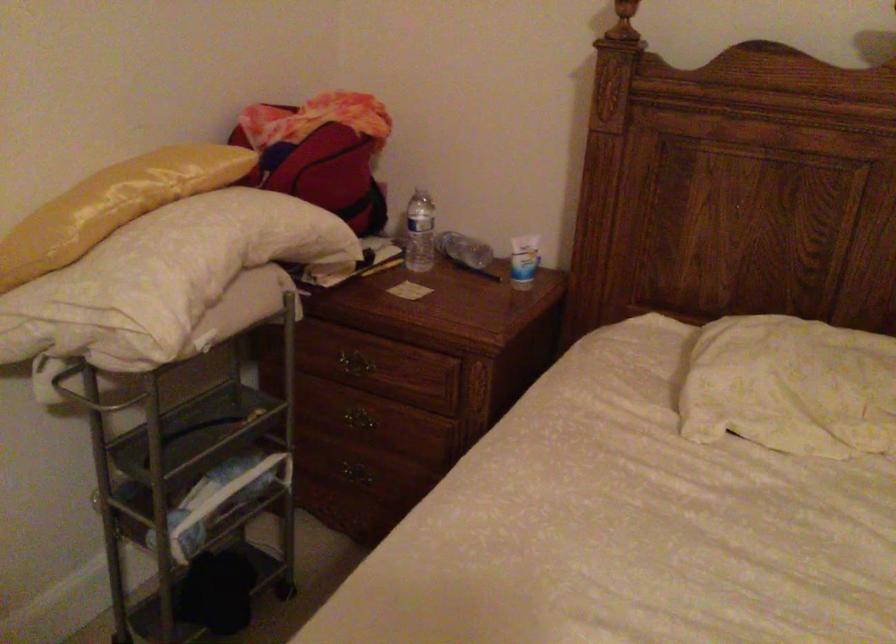
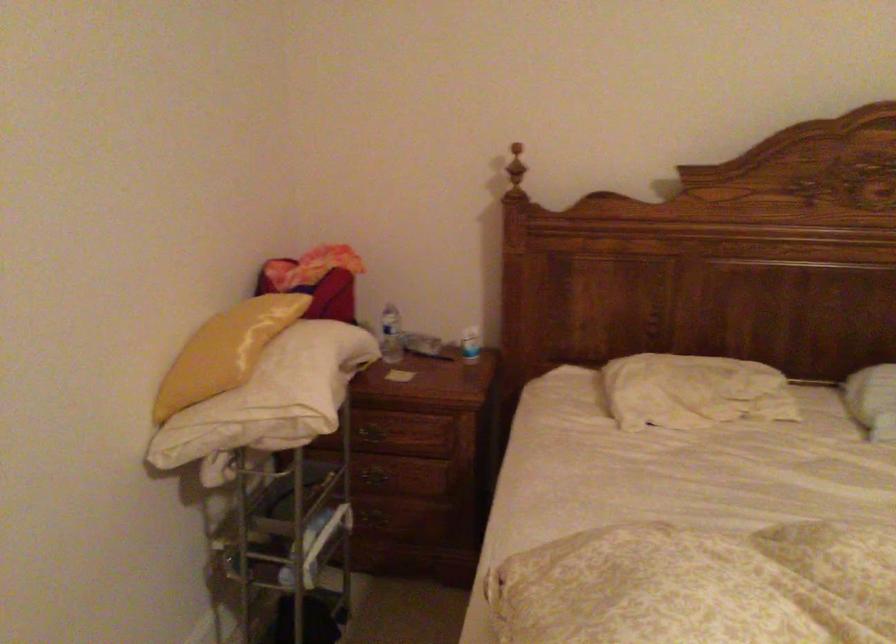
In the second image, find the point that corresponds to pixel 515 261 in the first image.

(470, 344)